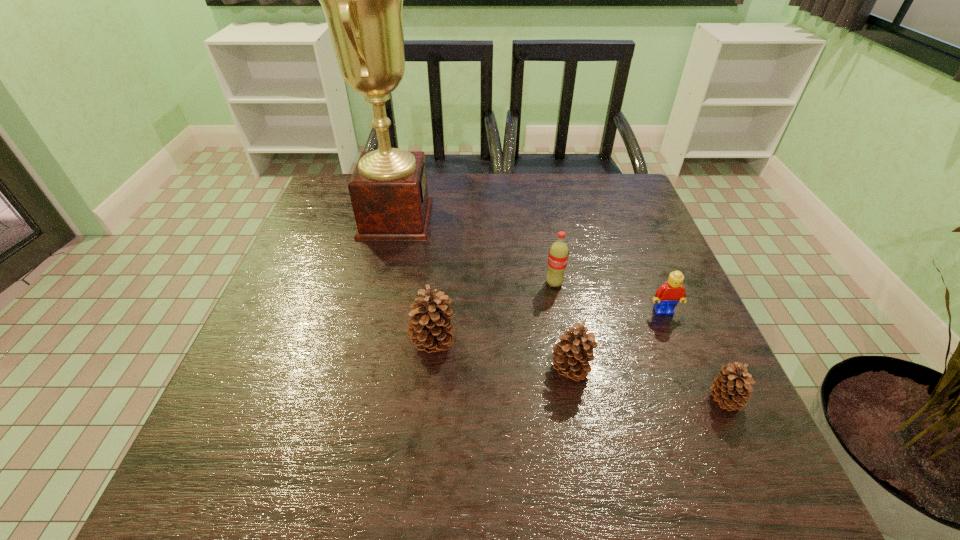
Please show where to add a pinecone on the left while keeping spacing even. Please provide its 2D coordinates. Your answer should be formatted as a tuple, i.e. [(x, y)], where the tuple contains the x and y coordinates of a point satisfying the conditions above.

[(308, 320)]